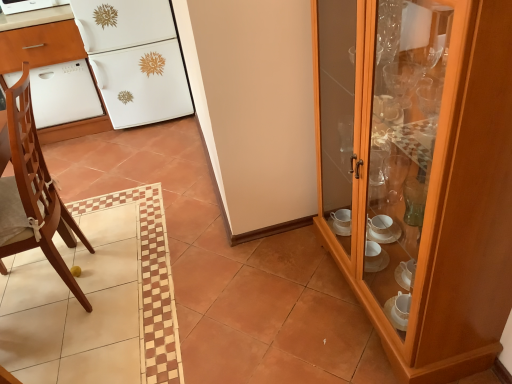
What is the approximate width of white glossy dishwasher at upper left?

The width of white glossy dishwasher at upper left is 15.31 inches.

The width and height of the screenshot is (512, 384). What do you see at coordinates (421, 170) in the screenshot?
I see `wooden cabinet at right` at bounding box center [421, 170].

This screenshot has width=512, height=384. Identify the location of white glossy refrigerator at upper left. click(x=135, y=59).

Is white glossy dishwasher at upper left far away from white glossy oven at left?

No, white glossy dishwasher at upper left is in close proximity to white glossy oven at left.

Can we say white glossy dishwasher at upper left lies outside white glossy oven at left?

Yes.

Between white glossy dishwasher at upper left and white glossy oven at left, which one has larger size?

white glossy oven at left.

Based on their positions, is white glossy dishwasher at upper left located to the left or right of white glossy oven at left?

white glossy dishwasher at upper left is positioned on white glossy oven at left's left side.

From the image's perspective, which one is positioned higher, white glossy oven at left or white glossy dishwasher at left?

From the image's view, white glossy dishwasher at left is above.

Can you confirm if white glossy oven at left is smaller than white glossy dishwasher at left?

Yes.

Which is less distant, (64, 103) or (70, 20)?

The point (70, 20) is more forward.

Between wooden cabinet at right and white glossy oven at left, which one has more height?

wooden cabinet at right is taller.

Between wooden cabinet at right and white glossy oven at left, which one has smaller width?

Thinner between the two is wooden cabinet at right.

Which object is positioned more to the right, wooden cabinet at right or white glossy oven at left?

Positioned to the right is wooden cabinet at right.

From the image's perspective, is wooden cabinet at right beneath white glossy oven at left?

Correct, wooden cabinet at right appears lower than white glossy oven at left in the image.

Between white glossy refrigerator at upper left and wooden cabinet at right, which one has more height?

Standing taller between the two is wooden cabinet at right.

In terms of size, does white glossy refrigerator at upper left appear bigger or smaller than wooden cabinet at right?

Clearly, white glossy refrigerator at upper left is smaller in size than wooden cabinet at right.

Could you tell me if white glossy refrigerator at upper left is facing wooden cabinet at right?

Yes, white glossy refrigerator at upper left is oriented towards wooden cabinet at right.

From the picture: From a real-world perspective, is white glossy refrigerator at upper left positioned above or below wooden cabinet at right?

white glossy refrigerator at upper left is situated lower than wooden cabinet at right in the real world.

From a real-world perspective, between wooden cabinet at right and light brown wooden chair at left, who is vertically lower?

light brown wooden chair at left is physically lower.

Can you confirm if wooden cabinet at right is taller than light brown wooden chair at left?

Indeed, wooden cabinet at right has a greater height compared to light brown wooden chair at left.

Between wooden cabinet at right and light brown wooden chair at left, which one is positioned in front?

wooden cabinet at right.

From the picture: Would you say wooden cabinet at right contains light brown wooden chair at left?

No, light brown wooden chair at left is located outside of wooden cabinet at right.

Does white glossy oven at left have a greater width compared to white glossy dishwasher at upper left?

Yes.

Where is `appliance on the left of white glossy oven at left`? appliance on the left of white glossy oven at left is located at coordinates tap(28, 5).

Which object is further away from the camera taking this photo, white glossy oven at left or white glossy dishwasher at upper left?

white glossy oven at left is behind.

The width and height of the screenshot is (512, 384). I want to click on chair above the white glossy oven at left (from a real-world perspective), so click(x=33, y=193).

Considering the sizes of objects white glossy oven at left and light brown wooden chair at left in the image provided, who is shorter, white glossy oven at left or light brown wooden chair at left?

white glossy oven at left is shorter.

Considering the positions of objects white glossy oven at left and light brown wooden chair at left in the image provided, who is in front, white glossy oven at left or light brown wooden chair at left?

light brown wooden chair at left.

From the image's perspective, between white glossy oven at left and light brown wooden chair at left, who is located below?

light brown wooden chair at left, from the image's perspective.

Where is `appliance above the white glossy oven at left (from the image's perspective)`? The image size is (512, 384). appliance above the white glossy oven at left (from the image's perspective) is located at coordinates (28, 5).

Locate an element on the screen. desk in front of the white glossy oven at left is located at coordinates pyautogui.click(x=39, y=40).

When comparing their distances from white glossy dishwasher at upper left, does wooden cabinet at right or white glossy dishwasher at left seem closer?

white glossy dishwasher at left lies closer to white glossy dishwasher at upper left than the other object.

Considering their positions, is white glossy dishwasher at upper left positioned closer to white glossy dishwasher at left than white glossy refrigerator at upper left?

Based on the image, white glossy refrigerator at upper left appears to be nearer to white glossy dishwasher at left.

Considering their positions, is light brown wooden chair at left positioned closer to wooden cabinet at right than white glossy dishwasher at left?

light brown wooden chair at left is closer to wooden cabinet at right.

Estimate the real-world distances between objects in this image. Which object is closer to white glossy dishwasher at left, wooden cabinet at right or white glossy oven at left?

Based on the image, white glossy oven at left appears to be nearer to white glossy dishwasher at left.

Considering their positions, is white glossy dishwasher at upper left positioned further to white glossy dishwasher at left than wooden cabinet at right?

Among the two, wooden cabinet at right is located further to white glossy dishwasher at left.

Estimate the real-world distances between objects in this image. Which object is closer to wooden cabinet at right, white glossy dishwasher at left or light brown wooden chair at left?

light brown wooden chair at left is closer to wooden cabinet at right.

Looking at the image, which one is located closer to white glossy dishwasher at upper left, white glossy refrigerator at upper left or white glossy dishwasher at left?

Based on the image, white glossy dishwasher at left appears to be nearer to white glossy dishwasher at upper left.

From the image, which object appears to be farther from white glossy oven at left, white glossy dishwasher at left or light brown wooden chair at left?

light brown wooden chair at left is further to white glossy oven at left.

You are a GUI agent. You are given a task and a screenshot of the screen. Output one action in this format:
    pyautogui.click(x=<x>, y=<y>)
    Task: Click on the refrigerator located between wooden cabinet at right and white glossy dishwasher at left in the depth direction
    
    Given the screenshot: What is the action you would take?
    pyautogui.click(x=135, y=59)

You are a GUI agent. You are given a task and a screenshot of the screen. Output one action in this format:
    pyautogui.click(x=<x>, y=<y>)
    Task: Click on the appliance located between light brown wooden chair at left and white glossy oven at left in the depth direction
    The image size is (512, 384).
    Given the screenshot: What is the action you would take?
    pyautogui.click(x=28, y=5)

I want to click on desk between white glossy dishwasher at upper left and white glossy oven at left vertically, so click(x=39, y=40).

Locate an element on the screen. This screenshot has width=512, height=384. chair between wooden cabinet at right and white glossy dishwasher at left along the z-axis is located at coordinates (33, 193).